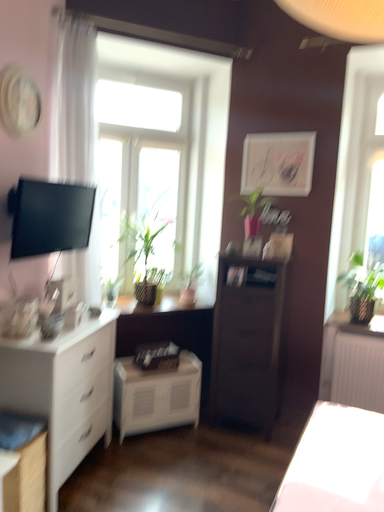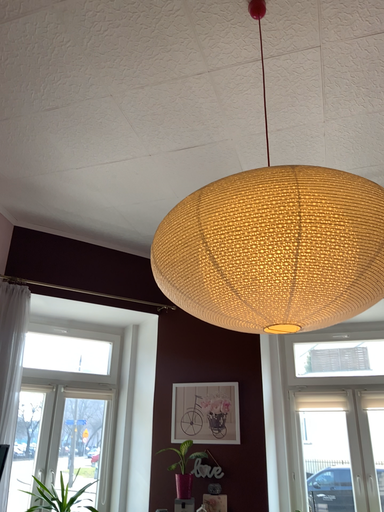
Question: How did the camera likely rotate when shooting the video?

Choices:
 (A) rotated upward
 (B) rotated downward

Answer: (A)